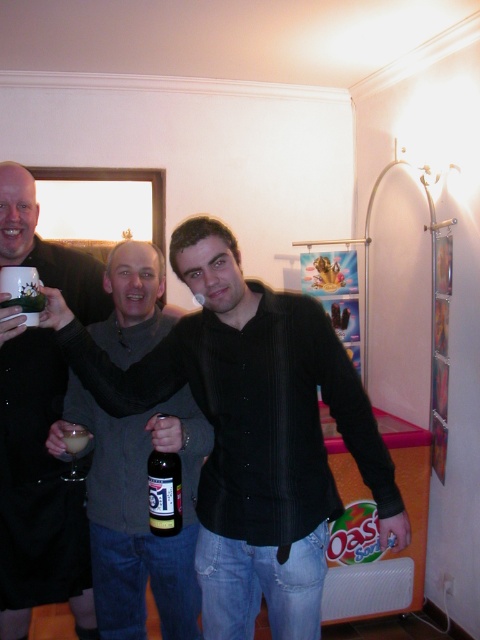
You are a GUI agent. You are given a task and a screenshot of the screen. Output one action in this format:
    pyautogui.click(x=<x>, y=<y>)
    Task: Click on the black matte shirt at center
    The width and height of the screenshot is (480, 640).
    Given the screenshot: What is the action you would take?
    pyautogui.click(x=252, y=432)

Does black matte shirt at center have a greater height compared to gray sweater at center?

Incorrect, black matte shirt at center's height is not larger of gray sweater at center's.

Who is more distant from viewer, (273, 472) or (156, 336)?

The point (156, 336) is behind.

At what (x,y) coordinates should I click in order to perform the action: click on black matte shirt at center. Please return your answer as a coordinate pair (x, y). The width and height of the screenshot is (480, 640). Looking at the image, I should click on (252, 432).

Is matte black mug at upper left thinner than brown glass bottle at center?

In fact, matte black mug at upper left might be wider than brown glass bottle at center.

Does matte black mug at upper left have a greater width compared to brown glass bottle at center?

Indeed, matte black mug at upper left has a greater width compared to brown glass bottle at center.

What are the coordinates of `matte black mug at upper left` in the screenshot? It's located at (36, 490).

You are a GUI agent. You are given a task and a screenshot of the screen. Output one action in this format:
    pyautogui.click(x=<x>, y=<y>)
    Task: Click on the matte black mug at upper left
    
    Given the screenshot: What is the action you would take?
    pyautogui.click(x=36, y=490)

Between black matte shirt at center and translucent glass beer at center, which one has less height?

Standing shorter between the two is translucent glass beer at center.

Does black matte shirt at center have a larger size compared to translucent glass beer at center?

Correct, black matte shirt at center is larger in size than translucent glass beer at center.

In order to click on black matte shirt at center in this screenshot , I will do `click(252, 432)`.